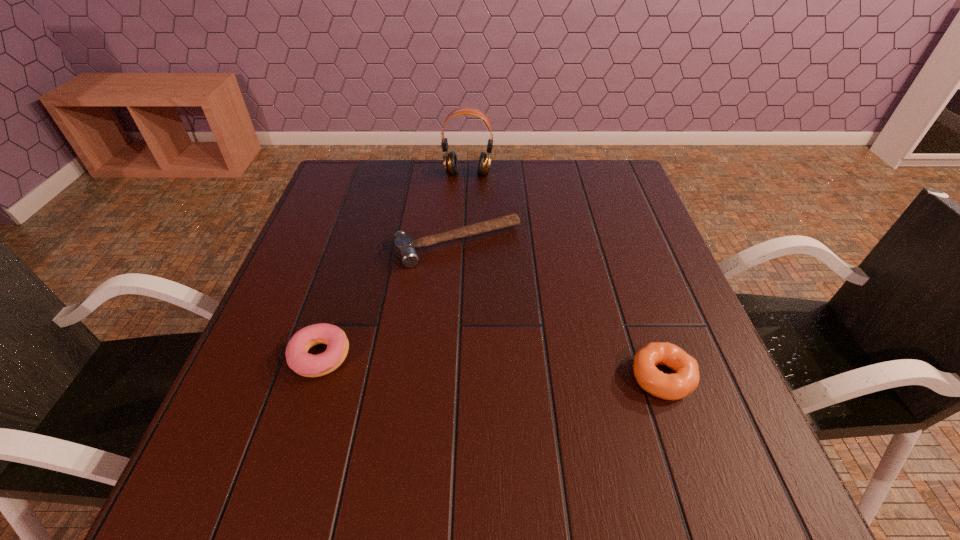
Find the location of a particular element. free spot between the shortest object and the right doughnut is located at coordinates (561, 310).

The height and width of the screenshot is (540, 960). In order to click on empty space between the second farthest object and the headset in this screenshot , I will do `click(463, 209)`.

At what (x,y) coordinates should I click in order to perform the action: click on free space that is in between the right doughnut and the tallest object. Please return your answer as a coordinate pair (x, y). Looking at the image, I should click on (565, 275).

Identify the location of free space between the right doughnut and the shortest object. (561, 310).

Identify which object is the third nearest to the shortest object. Please provide its 2D coordinates. Your answer should be formatted as a tuple, i.e. [(x, y)], where the tuple contains the x and y coordinates of a point satisfying the conditions above.

[(679, 385)]

You are a GUI agent. You are given a task and a screenshot of the screen. Output one action in this format:
    pyautogui.click(x=<x>, y=<y>)
    Task: Click on the object that stands as the closest to the leftmost object
    The height and width of the screenshot is (540, 960).
    Given the screenshot: What is the action you would take?
    pyautogui.click(x=404, y=245)

At what (x,y) coordinates should I click in order to perform the action: click on free location that satisfies the following two spatial constraints: 1. on the back side of the shortest object; 2. on the right side of the leftmost object. Please return your answer as a coordinate pair (x, y). Looking at the image, I should click on (355, 244).

You are a GUI agent. You are given a task and a screenshot of the screen. Output one action in this format:
    pyautogui.click(x=<x>, y=<y>)
    Task: Click on the free space that satisfies the following two spatial constraints: 1. on the back side of the hammer; 2. on the right side of the farthest object
    
    Given the screenshot: What is the action you would take?
    pyautogui.click(x=462, y=174)